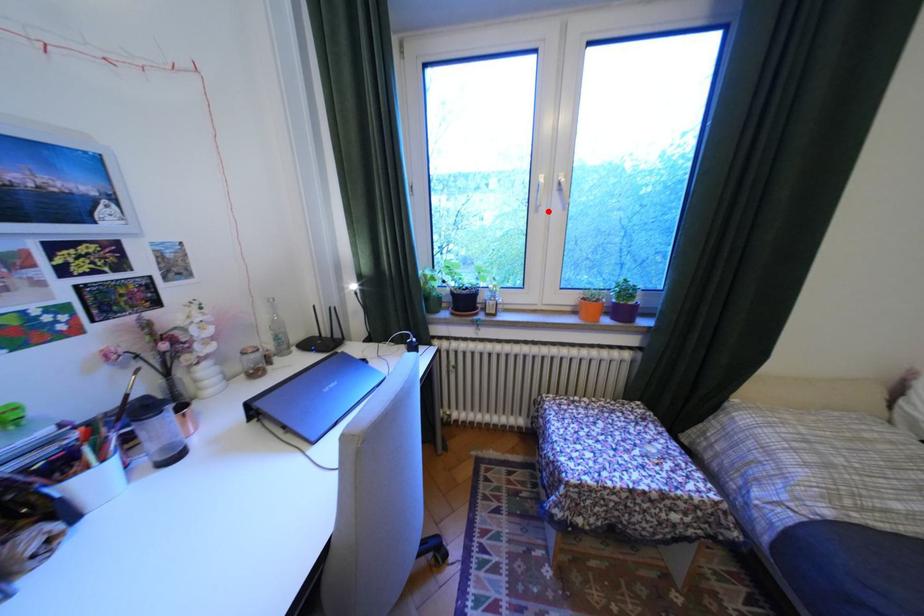
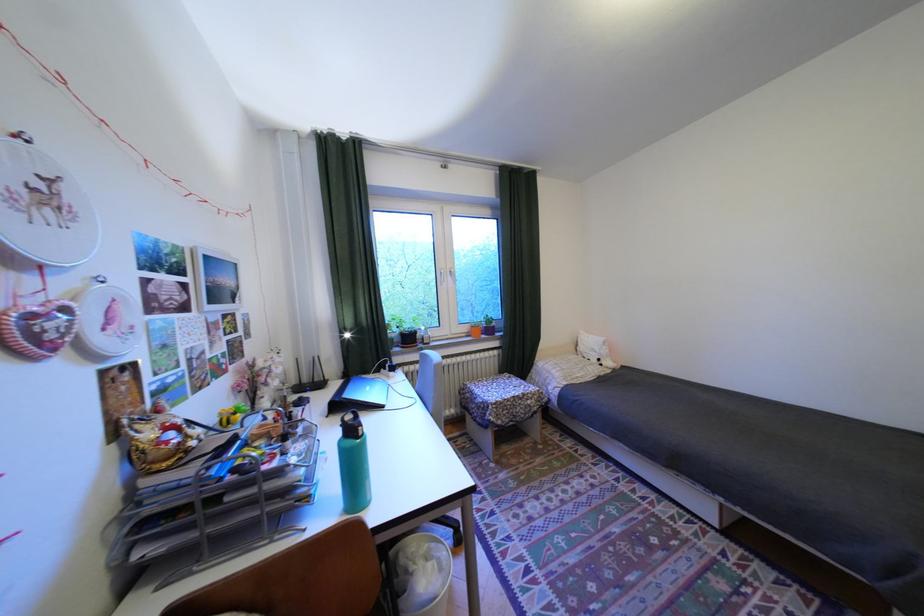
Locate, in the second image, the point that corresponds to the highlighted location in the first image.

(454, 285)